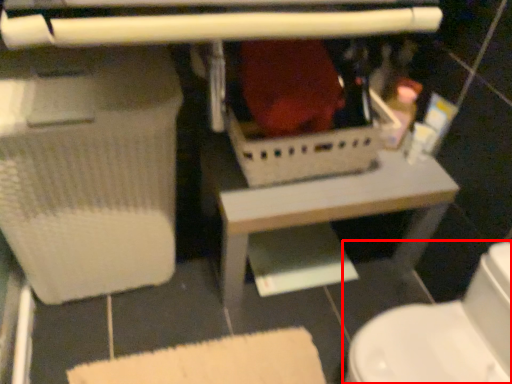
Question: In this image, where is toilet (annotated by the red box) located relative to table?

Choices:
 (A) left
 (B) right

Answer: (B)